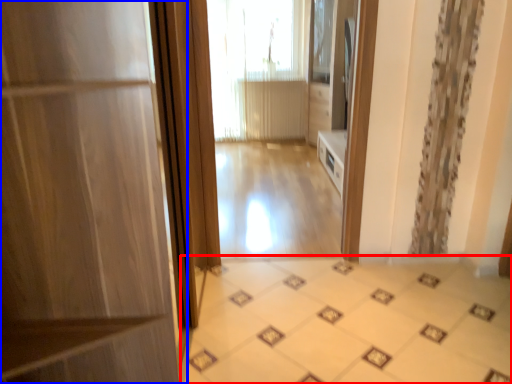
Question: Which of the following is the farthest to the observer, ceramic tile (highlighted by a red box) or door (highlighted by a blue box)?

Choices:
 (A) ceramic tile
 (B) door

Answer: (A)